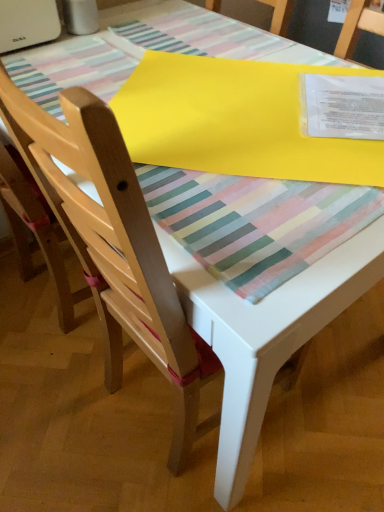
The width and height of the screenshot is (384, 512). What are the coordinates of `vacant space behind yellow matte paper at upper center` in the screenshot? It's located at (194, 37).